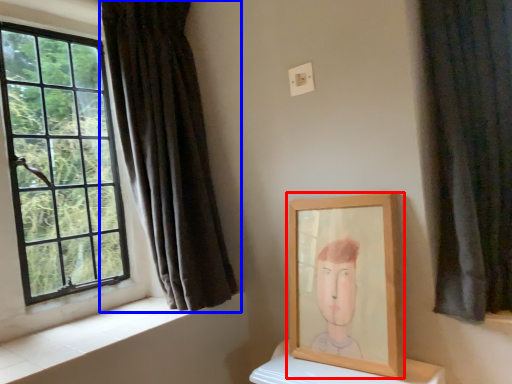
Question: Which object appears closest to the camera in this image, picture frame (highlighted by a red box) or curtain (highlighted by a blue box)?

Choices:
 (A) picture frame
 (B) curtain

Answer: (A)